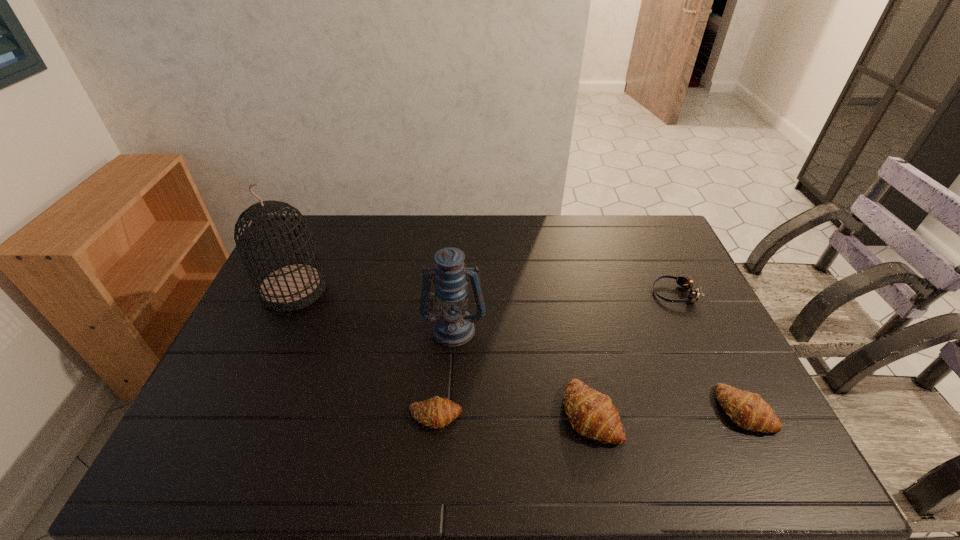
Locate an element on the screen. Image resolution: width=960 pixels, height=540 pixels. free space between the lantern and the shortest crescent roll is located at coordinates (444, 372).

Where is `free spot between the third tallest object and the goggles`? free spot between the third tallest object and the goggles is located at coordinates (633, 353).

Identify the location of free area in between the goggles and the lantern. This screenshot has height=540, width=960. (564, 311).

This screenshot has height=540, width=960. I want to click on free spot between the birdcage and the tallest crescent roll, so click(x=442, y=351).

The image size is (960, 540). Identify the location of vacant space in between the tallest crescent roll and the birdcage. (442, 351).

Where is `unoccupied position between the rightmost crescent roll and the birdcage`? unoccupied position between the rightmost crescent roll and the birdcage is located at coordinates pos(519,349).

The height and width of the screenshot is (540, 960). Identify the location of object that stands as the closest to the lantern. (437, 412).

The width and height of the screenshot is (960, 540). What are the coordinates of `the second closest object relative to the fourth tallest object` in the screenshot? It's located at (686, 283).

Find the location of a particular element. Image resolution: width=960 pixels, height=540 pixels. crescent roll that is the second closest one to the goggles is located at coordinates (591, 413).

Locate an element on the screen. the second closest crescent roll to the leftmost crescent roll is located at coordinates (748, 410).